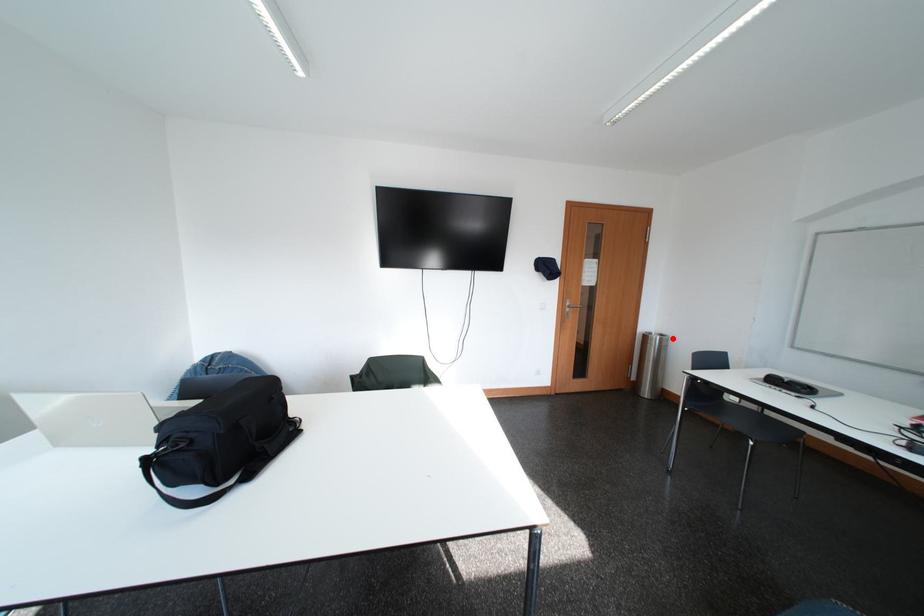
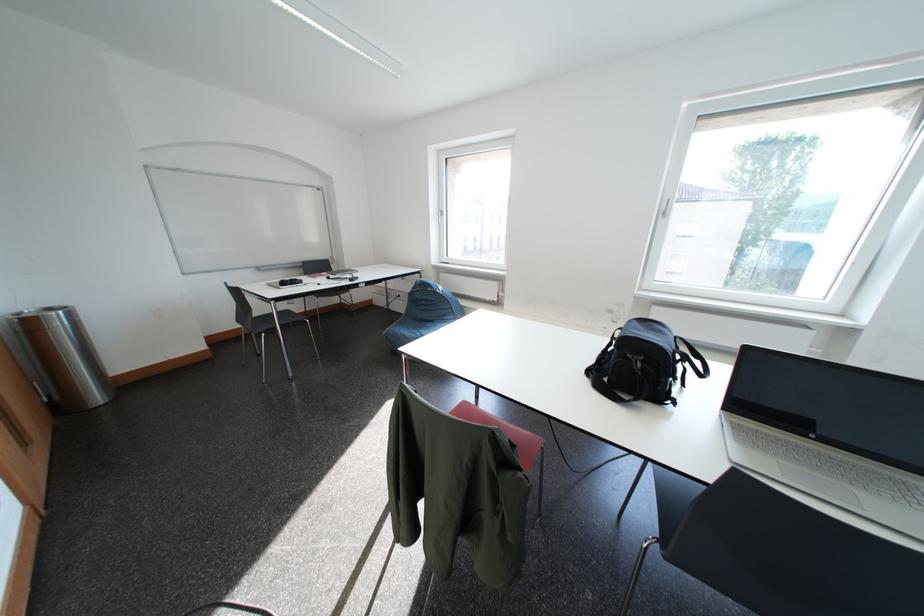
Question: I am providing you with two images of the same scene from different viewpoints. A red point is shown in image1. For the corresponding object point in image2, is it positioned nearer or farther from the camera?

Choices:
 (A) Nearer
 (B) Farther

Answer: (B)